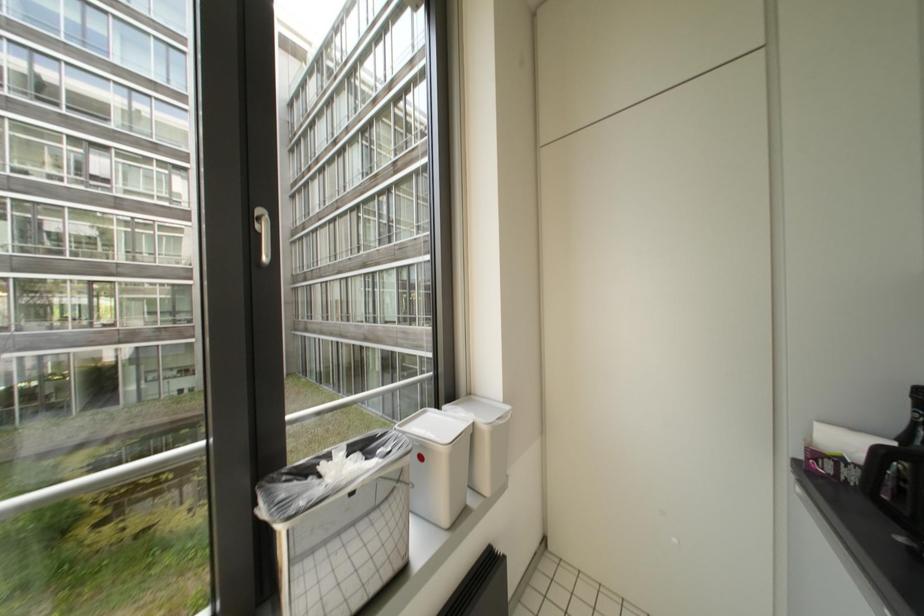
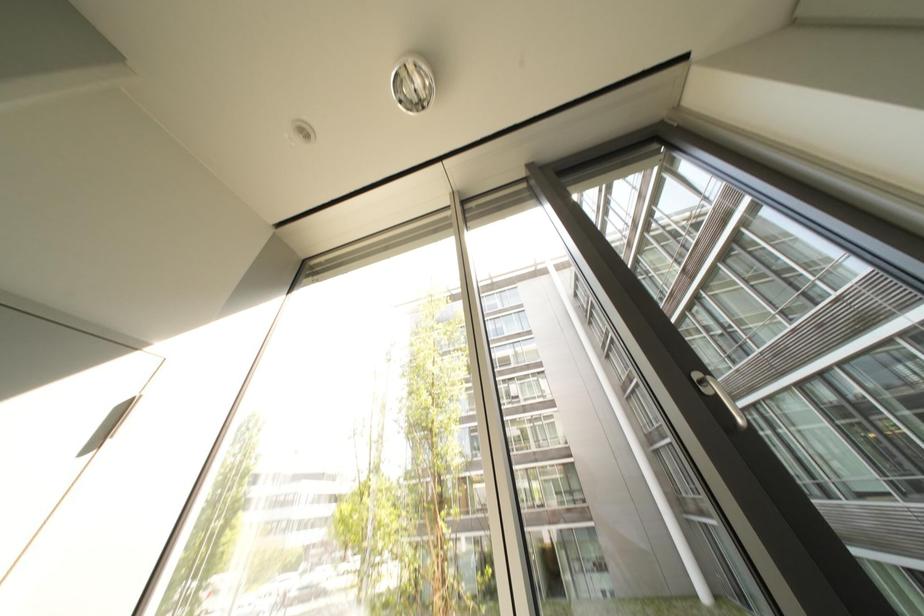
In the scene shown: The images are taken continuously from a first-person perspective. In which direction is your viewpoint rotating?

The camera's rotation is toward left-up.